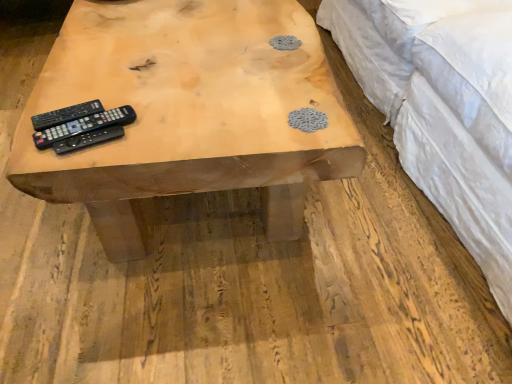
Question: Which direction should I rotate to look at black matte remote control at center, which is the third remote control from back to front, — up or down?

Choices:
 (A) down
 (B) up

Answer: (B)

Question: Is black plastic remote at left, which ranks as the 2th remote control in front-to-back order, thinner than black matte remote control at left, which is the first remote control from back to front?

Choices:
 (A) no
 (B) yes

Answer: (A)

Question: Does black plastic remote at left, which ranks as the 2th remote control in back-to-front order, have a greater width compared to black matte remote control at left, the 3th remote control from the front?

Choices:
 (A) yes
 (B) no

Answer: (A)

Question: From a real-world perspective, is black plastic remote at left, which ranks as the 2th remote control in front-to-back order, over black matte remote control at left, the 3th remote control from the front?

Choices:
 (A) no
 (B) yes

Answer: (A)

Question: Could you tell me if black plastic remote at left, which ranks as the 2th remote control in front-to-back order, is turned towards black matte remote control at left, the 3th remote control from the front?

Choices:
 (A) no
 (B) yes

Answer: (A)

Question: Is the position of black plastic remote at left, which ranks as the 2th remote control in back-to-front order, more distant than that of black matte remote control at left, which is the first remote control from back to front?

Choices:
 (A) no
 (B) yes

Answer: (A)

Question: Is the position of black plastic remote at left, which ranks as the 2th remote control in front-to-back order, less distant than that of black matte remote control at left, which is the first remote control from back to front?

Choices:
 (A) no
 (B) yes

Answer: (B)

Question: From a real-world perspective, is white quilted fabric at upper right positioned over black matte remote control at center, which appears as the first remote control when viewed from the front, based on gravity?

Choices:
 (A) yes
 (B) no

Answer: (B)

Question: Is white quilted fabric at upper right touching black matte remote control at center, which is the third remote control from back to front?

Choices:
 (A) no
 (B) yes

Answer: (A)

Question: Is white quilted fabric at upper right positioned before black matte remote control at center, which is the third remote control from back to front?

Choices:
 (A) yes
 (B) no

Answer: (A)

Question: From a real-world perspective, is white quilted fabric at upper right below black matte remote control at center, which appears as the first remote control when viewed from the front?

Choices:
 (A) no
 (B) yes

Answer: (B)

Question: Can we say white quilted fabric at upper right lies outside black matte remote control at center, which is the third remote control from back to front?

Choices:
 (A) yes
 (B) no

Answer: (A)

Question: Is white quilted fabric at upper right oriented towards black matte remote control at center, which appears as the first remote control when viewed from the front?

Choices:
 (A) no
 (B) yes

Answer: (B)

Question: Does white quilted fabric at upper right come in front of natural wood table at center?

Choices:
 (A) no
 (B) yes

Answer: (B)